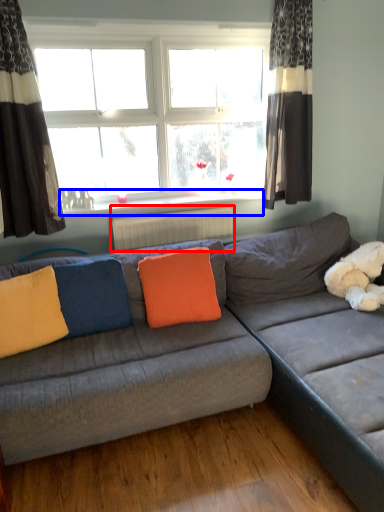
Question: Which object is further to the camera taking this photo, radiator (highlighted by a red box) or window sill (highlighted by a blue box)?

Choices:
 (A) radiator
 (B) window sill

Answer: (A)